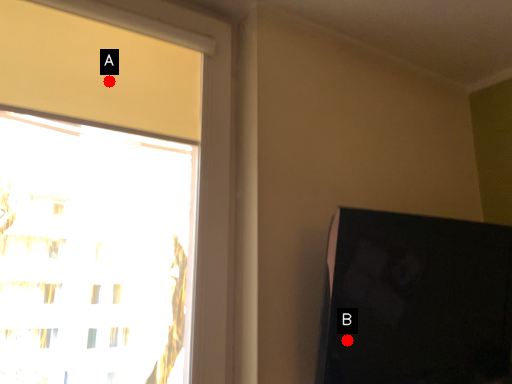
Question: Two points are circled on the image, labeled by A and B beside each circle. Which point appears closest to the camera in this image?

Choices:
 (A) A is closer
 (B) B is closer

Answer: (B)